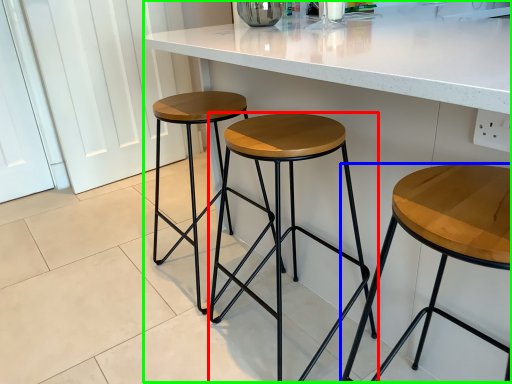
Question: Based on their relative distances, which object is farther from stool (highlighted by a red box)? Choose from stool (highlighted by a blue box) and counter (highlighted by a green box).

Choices:
 (A) stool
 (B) counter

Answer: (A)